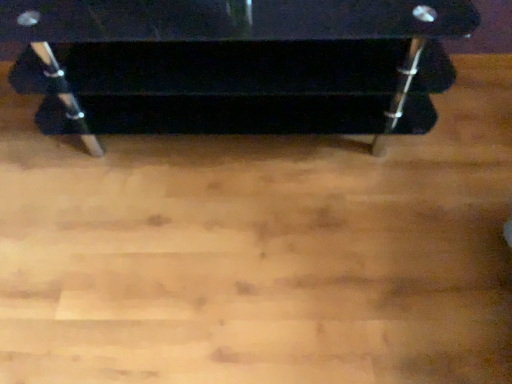
You are a GUI agent. You are given a task and a screenshot of the screen. Output one action in this format:
    pyautogui.click(x=<x>, y=<y>)
    Task: Click on the black glossy bench at center
    
    Given the screenshot: What is the action you would take?
    pyautogui.click(x=234, y=65)

What do you see at coordinates (234, 65) in the screenshot?
I see `black glossy bench at center` at bounding box center [234, 65].

What is the approximate width of black glossy bench at center?

It is 20.15 inches.

I want to click on black glossy bench at center, so click(x=234, y=65).